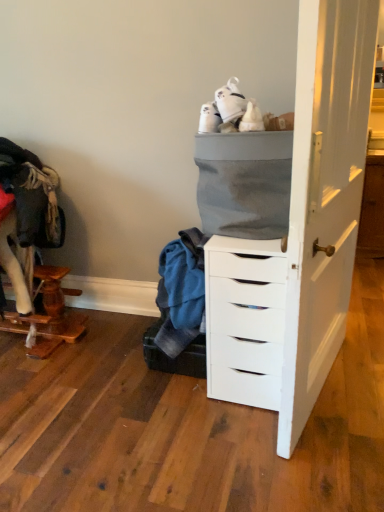
You are a GUI agent. You are given a task and a screenshot of the screen. Output one action in this format:
    pyautogui.click(x=<x>, y=<y>)
    Task: Click on the vacant area located to the right-hand side of wooden cat tree at left
    The width and height of the screenshot is (384, 512).
    Given the screenshot: What is the action you would take?
    pyautogui.click(x=109, y=345)